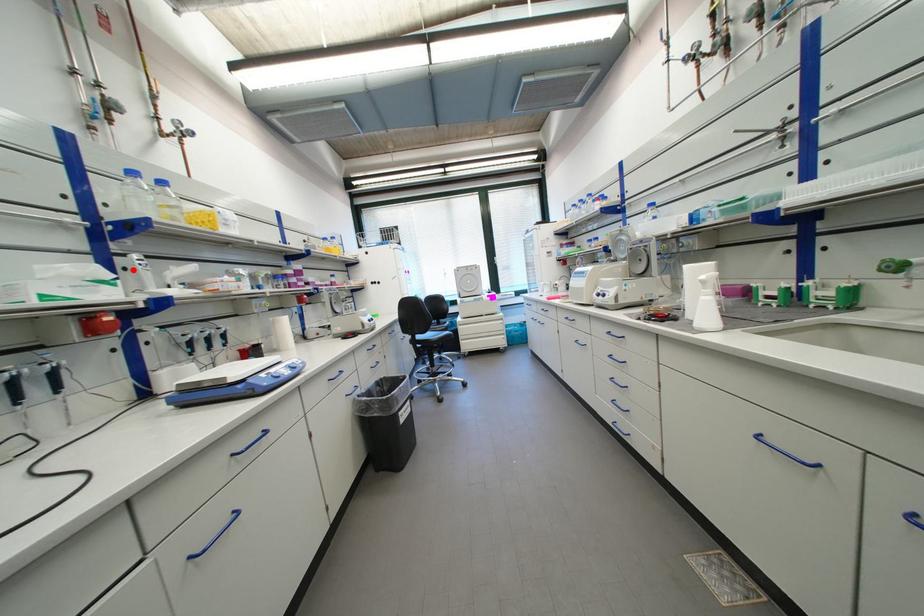
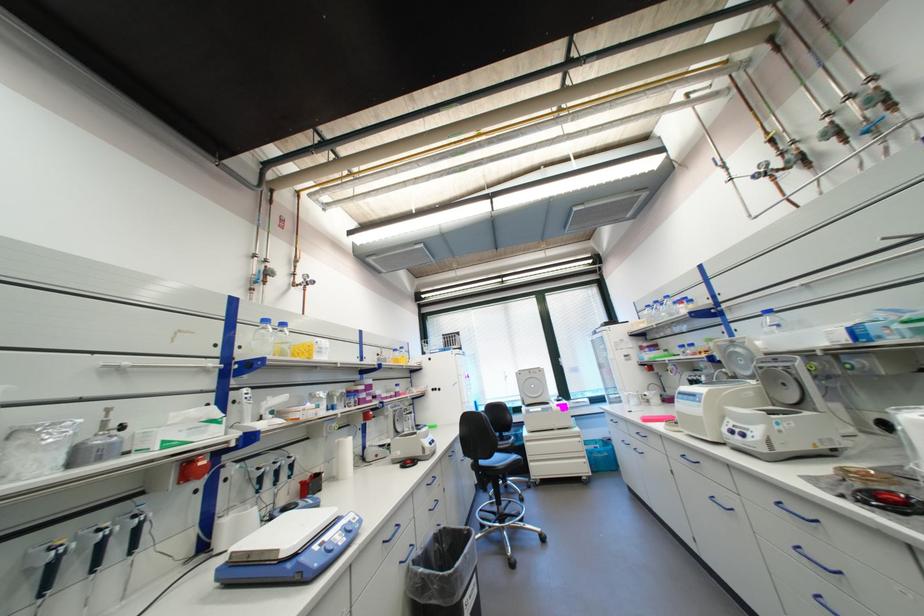
In the second image, find the point that corresponds to the highlighted location in the first image.

(242, 403)